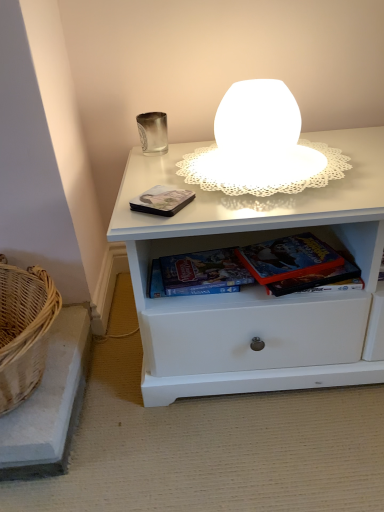
Where is `vacant region above hardcover book at lower center, acting as the 1th paperback book starting from the right (from a real-world perspective)`? This screenshot has width=384, height=512. vacant region above hardcover book at lower center, acting as the 1th paperback book starting from the right (from a real-world perspective) is located at coordinates (294, 252).